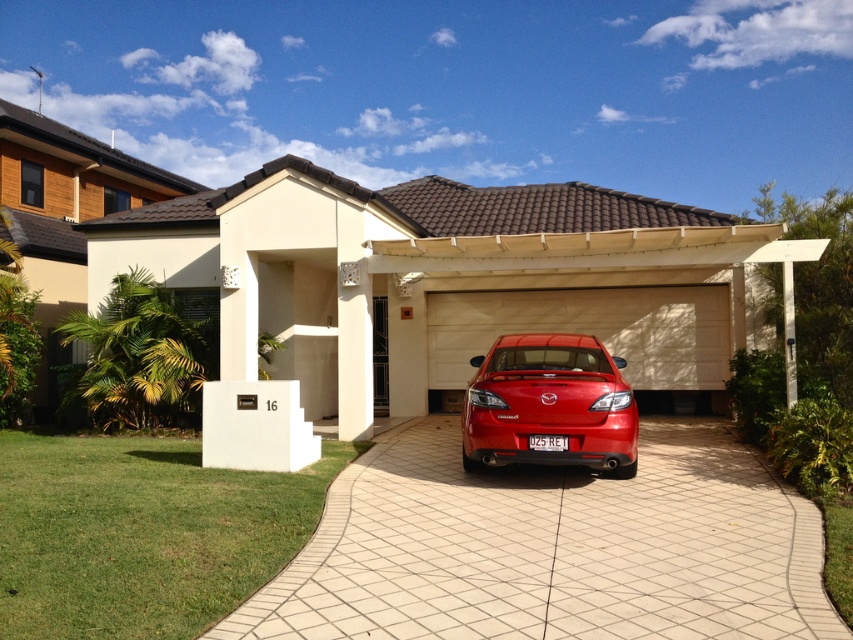
Question: Is white tile driveway at center to the right of beige/textured garage door at center from the viewer's perspective?

Choices:
 (A) yes
 (B) no

Answer: (B)

Question: Estimate the real-world distances between objects in this image. Which object is farther from the matte red car at center?

Choices:
 (A) matte white garage at center
 (B) beige/textured garage door at center
 (C) white tile driveway at center

Answer: (B)

Question: Where is white tile driveway at center located in relation to matte red car at center in the image?

Choices:
 (A) left
 (B) right

Answer: (A)

Question: Which object is closer to the camera taking this photo?

Choices:
 (A) matte red car at center
 (B) matte white garage at center
 (C) beige/textured garage door at center

Answer: (A)

Question: In this image, where is matte white garage at center located relative to white tile driveway at center?

Choices:
 (A) left
 (B) right

Answer: (A)

Question: Which of the following is the farthest from the observer?

Choices:
 (A) (462, 369)
 (B) (712, 544)

Answer: (A)